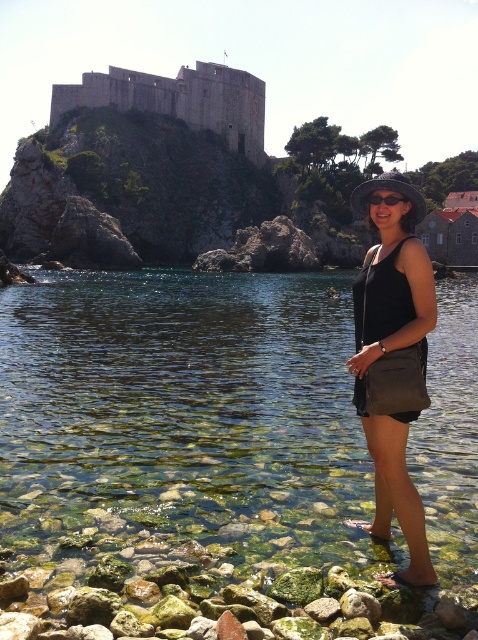
Is black fabric dress at lower right bigger than brown stone castle at upper left?

Incorrect, black fabric dress at lower right is not larger than brown stone castle at upper left.

Does point (386, 225) come farther from viewer compared to point (106, 100)?

No, it is not.

Where is `black fabric dress at lower right`? black fabric dress at lower right is located at coordinates (387, 356).

Can you confirm if clear glassy water at center is smaller than brown stone castle at upper left?

Incorrect, clear glassy water at center is not smaller in size than brown stone castle at upper left.

Is clear glassy water at center thinner than brown stone castle at upper left?

No.

Where is `clear glassy water at center`? Image resolution: width=478 pixels, height=640 pixels. clear glassy water at center is located at coordinates (184, 417).

Is black fabric dress at lower right below black plastic goggles at center?

Yes, black fabric dress at lower right is below black plastic goggles at center.

Describe the element at coordinates (387, 356) in the screenshot. I see `black fabric dress at lower right` at that location.

Measure the distance between point (x=351, y=365) and camera.

Point (x=351, y=365) is 40.07 meters from camera.

Where is `black fabric dress at lower right`? black fabric dress at lower right is located at coordinates (387, 356).